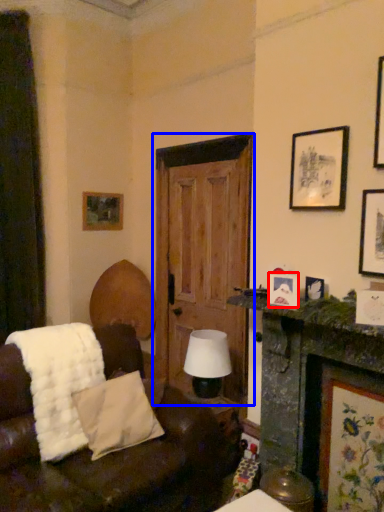
Question: Which point is closer to the camera, picture frame (highlighted by a red box) or door (highlighted by a blue box)?

Choices:
 (A) picture frame
 (B) door

Answer: (A)